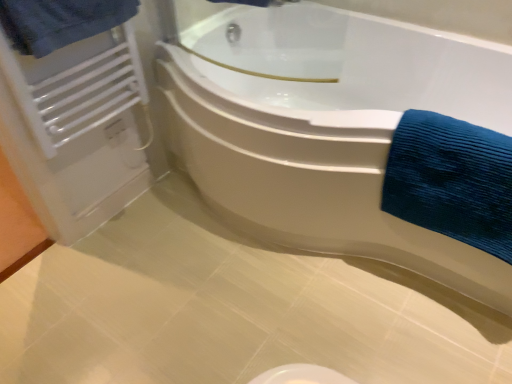
Question: Is point (90, 96) positioned closer to the camera than point (429, 216)?

Choices:
 (A) closer
 (B) farther

Answer: (B)

Question: In terms of height, does white metallic radiator at upper left look taller or shorter compared to blue textured towel at right, which ranks as the first bath towel in bottom-to-top order?

Choices:
 (A) tall
 (B) short

Answer: (A)

Question: Considering the real-world distances, which object is farthest from the white metallic radiator at upper left?

Choices:
 (A) blue textured towel at upper left, the 2th bath towel positioned from the right
 (B) blue textured towel at right, the 2th bath towel viewed from the left
 (C) white glossy bathtub at center

Answer: (B)

Question: Which of these objects is positioned farthest from the white glossy bathtub at center?

Choices:
 (A) white metallic radiator at upper left
 (B) blue textured towel at right, the 1th bath towel from the right
 (C) blue textured towel at upper left, the 1th bath towel in the left-to-right sequence

Answer: (C)